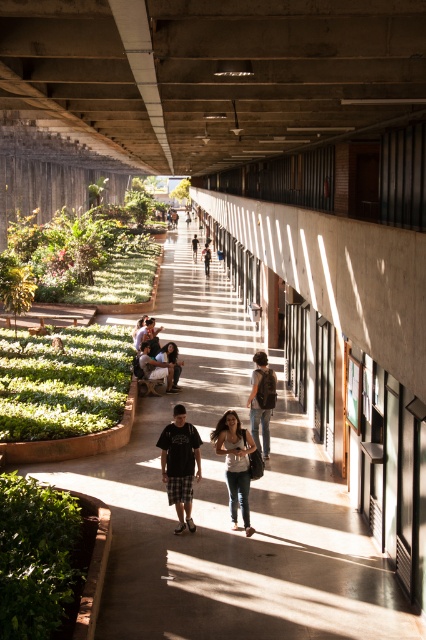
Is matte white shirt at center thinner than light brown leather backpack at center?

Yes.

From the picture: Does matte white shirt at center appear over light brown leather backpack at center?

No, matte white shirt at center is not above light brown leather backpack at center.

The height and width of the screenshot is (640, 426). I want to click on matte white shirt at center, so click(x=235, y=465).

This screenshot has height=640, width=426. In order to click on matte white shirt at center in this screenshot , I will do `click(235, 465)`.

Does matte white shirt at center have a lesser height compared to denim jacket at center?

In fact, matte white shirt at center may be taller than denim jacket at center.

Is point (233, 424) less distant than point (157, 356)?

Yes, point (233, 424) is in front of point (157, 356).

The image size is (426, 640). Identify the location of matte white shirt at center. (235, 465).

Can you confirm if matte white shirt at center is positioned above brown leather backpack at right?

Incorrect, matte white shirt at center is not positioned above brown leather backpack at right.

What do you see at coordinates (235, 465) in the screenshot?
I see `matte white shirt at center` at bounding box center [235, 465].

Between point (221, 436) and point (256, 403), which one is positioned behind?

Point (256, 403)

Find the location of a particular element. This screenshot has height=640, width=426. matte white shirt at center is located at coordinates (235, 465).